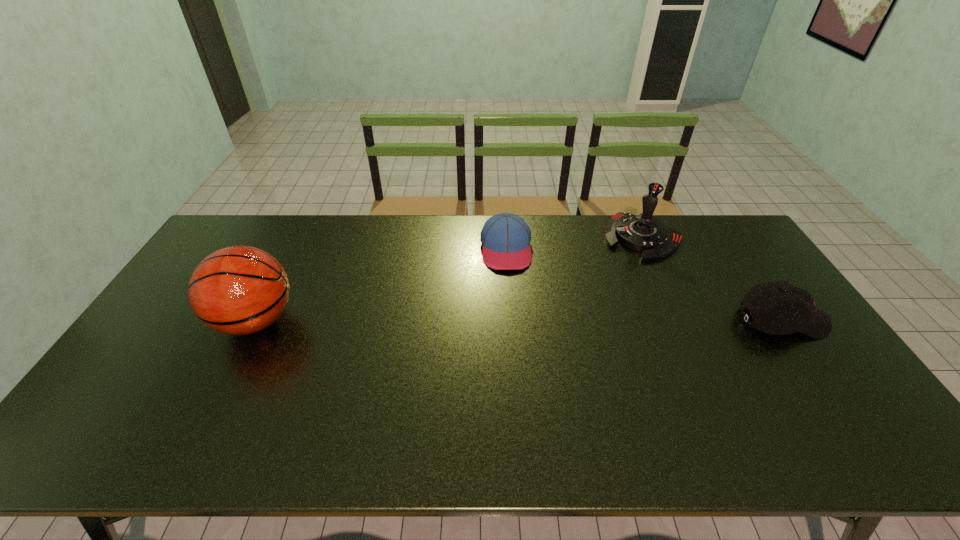
The width and height of the screenshot is (960, 540). What are the coordinates of `the leftmost object` in the screenshot? It's located at (239, 290).

Identify the location of the tallest object. (239, 290).

Locate an element on the screen. This screenshot has width=960, height=540. the right baseball cap is located at coordinates (788, 309).

Where is `the rightmost object`? The image size is (960, 540). the rightmost object is located at coordinates (788, 309).

Identify the location of the farther baseball cap. (505, 237).

Locate an element on the screen. This screenshot has height=540, width=960. the left baseball cap is located at coordinates [505, 237].

The height and width of the screenshot is (540, 960). I want to click on joystick, so click(644, 233).

The height and width of the screenshot is (540, 960). I want to click on the second object from right to left, so click(644, 233).

Identify the location of free space located 0.100m on the side with spill of the tallest object. Image resolution: width=960 pixels, height=540 pixels. (180, 321).

Locate an element on the screen. This screenshot has width=960, height=540. free space located 0.110m on the side with spill of the tallest object is located at coordinates (177, 321).